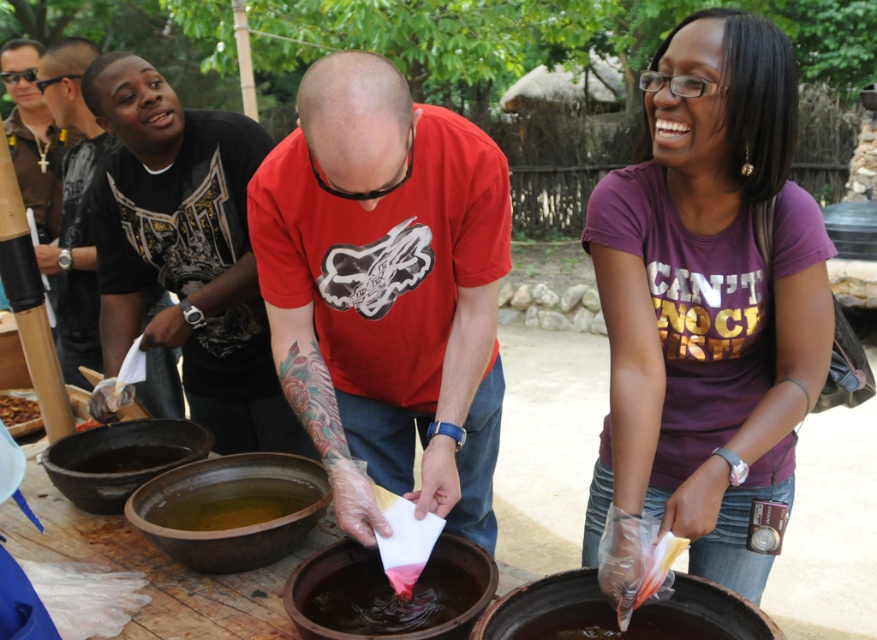
Question: Which of the following is the closest to the observer?

Choices:
 (A) yellowish liquid at center
 (B) brown glossy liquid at center
 (C) matte red t-shirt at center

Answer: (C)

Question: Can you confirm if dark brown clay pot at lower center is positioned above dark brown clay pot at lower left?

Choices:
 (A) yes
 (B) no

Answer: (B)

Question: In this image, where is black matte shirt at upper left located relative to dark brown clay pot at lower left?

Choices:
 (A) left
 (B) right

Answer: (A)

Question: Which point is closer to the camera?

Choices:
 (A) (619, 346)
 (B) (84, 100)

Answer: (A)

Question: Based on their relative distances, which object is nearer to the matte red t-shirt at center?

Choices:
 (A) brown crispy fried food at center left
 (B) black matte shirt at left
 (C) yellowish liquid at center

Answer: (C)

Question: Does black matte shirt at left come behind brown glossy liquid at center?

Choices:
 (A) no
 (B) yes

Answer: (B)